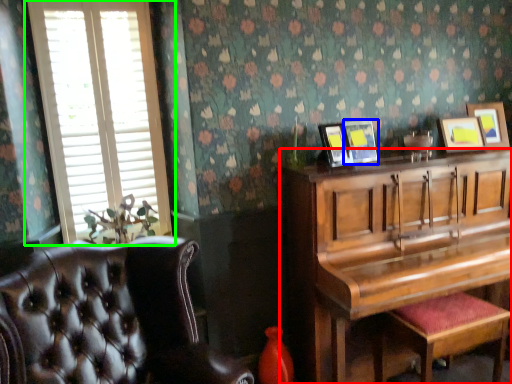
Question: Which is nearer to the piano (highlighted by a red box)? picture frame (highlighted by a blue box) or window (highlighted by a green box).

Choices:
 (A) picture frame
 (B) window

Answer: (A)